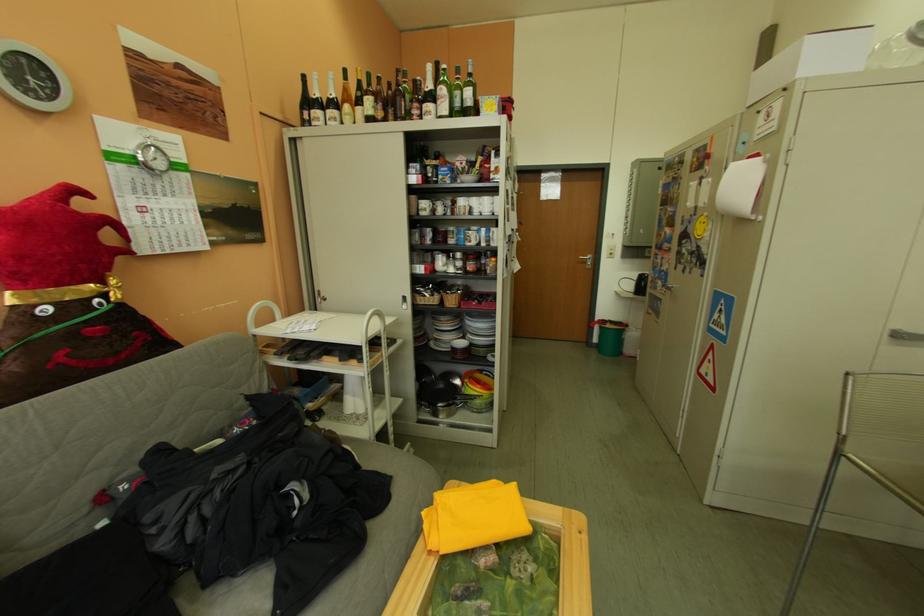
What do you see at coordinates (610, 337) in the screenshot?
I see `the green trash bin` at bounding box center [610, 337].